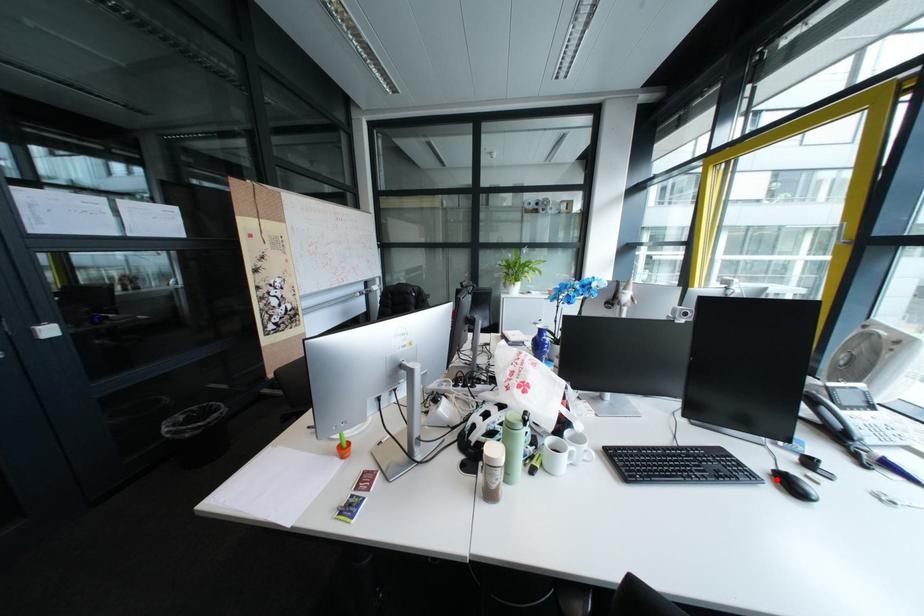
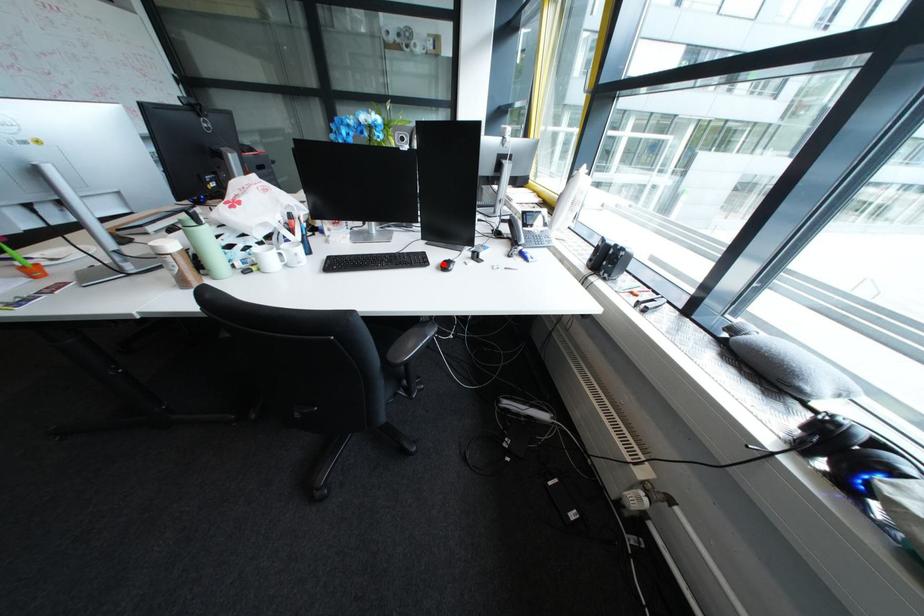
I am providing you with two images of the same scene from different viewpoints. A red point is marked on the first image and another point is marked on the second image. Does the point marked in image1 correspond to the same location as the one in image2?

Yes